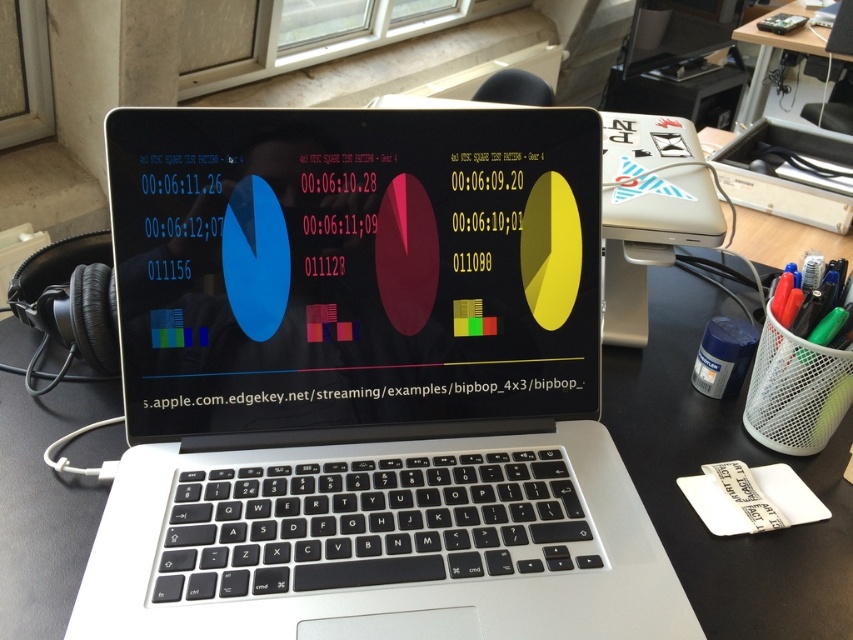
Question: Estimate the real-world distances between objects in this image. Which object is closer to the matte black screen at center?

Choices:
 (A) silver metallic laptop at center
 (B) wooden table at upper right
 (C) green matte pen at right

Answer: (A)

Question: Among these points, which one is farthest from the camera?

Choices:
 (A) (770, 35)
 (B) (773, 362)
 (C) (425, 381)
 (D) (264, 621)

Answer: (A)

Question: Which of the following is the closest to the observer?

Choices:
 (A) (306, 211)
 (B) (784, 413)
 (C) (790, 33)

Answer: (A)

Question: Is silver metallic laptop at center closer to camera compared to wooden table at upper right?

Choices:
 (A) no
 (B) yes

Answer: (B)

Question: Is silver metallic laptop at center below wooden table at upper right?

Choices:
 (A) no
 (B) yes

Answer: (B)

Question: Can you confirm if silver metallic laptop at center is positioned above matte black screen at center?

Choices:
 (A) yes
 (B) no

Answer: (B)